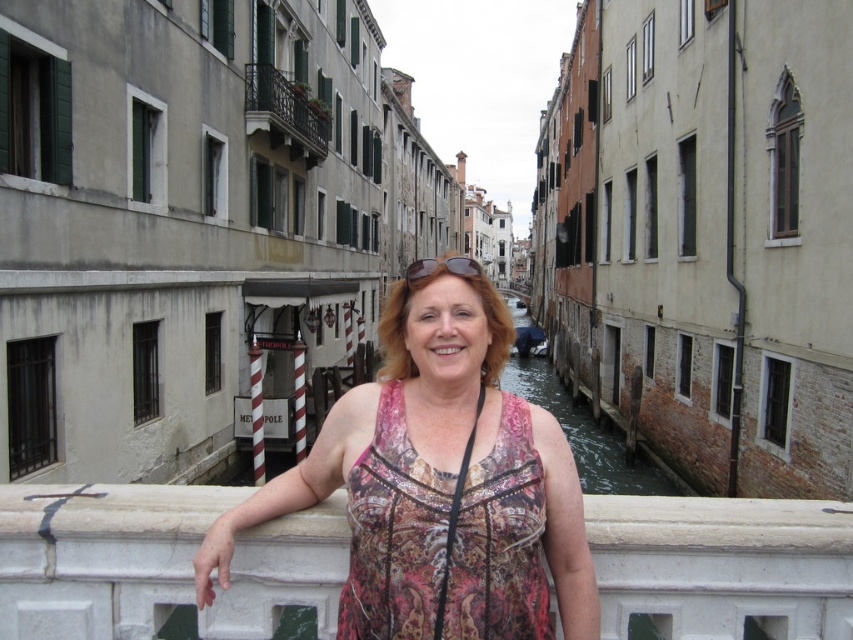
Measure the distance between printed fabric dress at center and camera.

9.85 meters

Does point (398, 620) lie behind point (273, 104)?

That is False.

Identify the location of printed fabric dress at center. This screenshot has width=853, height=640. (426, 461).

Does printed silk dress at center appear on the right side of dark brown wrought iron balcony at upper left?

Indeed, printed silk dress at center is positioned on the right side of dark brown wrought iron balcony at upper left.

Who is more forward, (515,445) or (270,132)?

Positioned in front is point (515,445).

Find the location of a particular element. printed silk dress at center is located at coordinates pos(445,536).

Is printed silk dress at center behind greenish concrete canal at center?

No, it is not.

Can you confirm if printed silk dress at center is positioned below greenish concrete canal at center?

Yes, printed silk dress at center is below greenish concrete canal at center.

Find the location of `printed silk dress at center`. printed silk dress at center is located at coordinates [x=445, y=536].